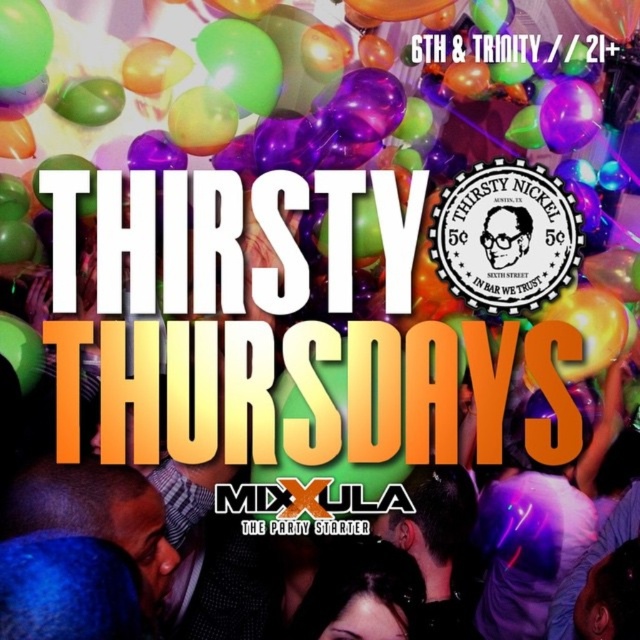
What is located at the coordinate point (x=362, y=595) in the image?

The black hair at center is located at the coordinate point (x=362, y=595).

You are designing a poster for Thirsty Thursdays and want to ensure the blue fabric at lower left and matte black glasses at center are visible. Given their sizes, which object should you place closer to the front to maintain visibility?

The blue fabric at lower left is larger than the matte black glasses at center. To maintain visibility, place the smaller matte black glasses at center closer to the front so it doesn not get lost behind the larger blue fabric at lower left.

You are standing at the center of the image. Where is the blue fabric at lower left located relative to your position?

The blue fabric at lower left is located at point 0.805 on the x axis and 0.152 on the y axis relative to the center of the image.